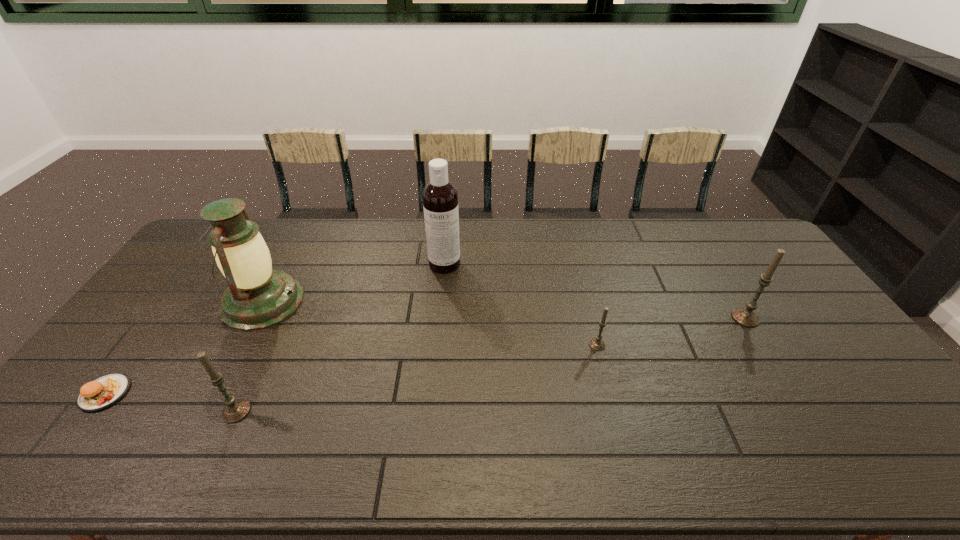
You are a GUI agent. You are given a task and a screenshot of the screen. Output one action in this format:
    pyautogui.click(x=<x>, y=<y>)
    Task: Click on the object positioned at the left edge
    This screenshot has width=960, height=540.
    Given the screenshot: What is the action you would take?
    pyautogui.click(x=103, y=392)

At what (x,y) coordinates should I click in order to perform the action: click on object that is positioned at the near left corner. Please return your answer as a coordinate pair (x, y). This screenshot has width=960, height=540. Looking at the image, I should click on (103, 392).

In the image, there is a desktop. Where is `free space at the far edge`? The image size is (960, 540). free space at the far edge is located at coordinates (370, 249).

Image resolution: width=960 pixels, height=540 pixels. What are the coordinates of `vacant space at the near edge of the desktop` in the screenshot? It's located at (689, 413).

You are a GUI agent. You are given a task and a screenshot of the screen. Output one action in this format:
    pyautogui.click(x=<x>, y=<y>)
    Task: Click on the vacant space at the right edge
    
    Given the screenshot: What is the action you would take?
    pyautogui.click(x=777, y=290)

The image size is (960, 540). What are the coordinates of `vacant space at the far left corner of the desktop` in the screenshot? It's located at (189, 257).

This screenshot has width=960, height=540. Identify the location of vacant space at the far right corner of the desktop. (718, 224).

Find the location of `empty space between the dishwasher detergent and the rightmost candle`. empty space between the dishwasher detergent and the rightmost candle is located at coordinates [595, 291].

You are a GUI agent. You are given a task and a screenshot of the screen. Output one action in this format:
    pyautogui.click(x=<x>, y=<y>)
    Task: Click on the vacant area that lies between the nearest candle and the second shortest object
    The image size is (960, 540).
    Given the screenshot: What is the action you would take?
    pyautogui.click(x=417, y=378)

The image size is (960, 540). I want to click on free space between the leftmost object and the dishwasher detergent, so click(x=275, y=328).